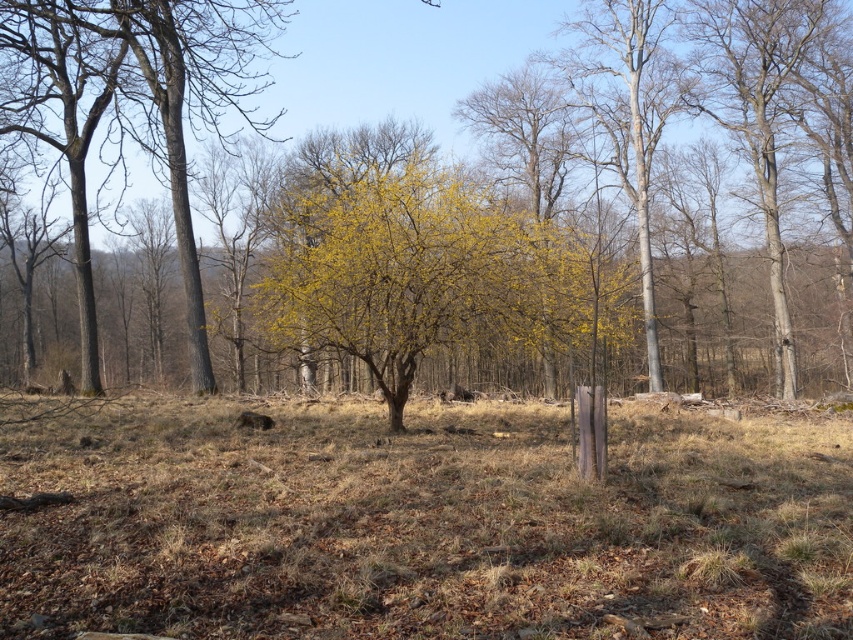
You are an environmental scientist assessing the woodland area. You notice the yellow leafy tree at center and the bare wood at right. Which object is positioned higher in the scene?

The yellow leafy tree at center is located above the bare wood at right, so it is positioned higher in the scene.

You are a hiker who wants to identify the largest tree in the woodland scene. Which tree should you choose between the smooth bark tree at left and the bare wood at right?

The smooth bark tree at left is bigger than the bare wood at right, so you should choose the smooth bark tree at left.